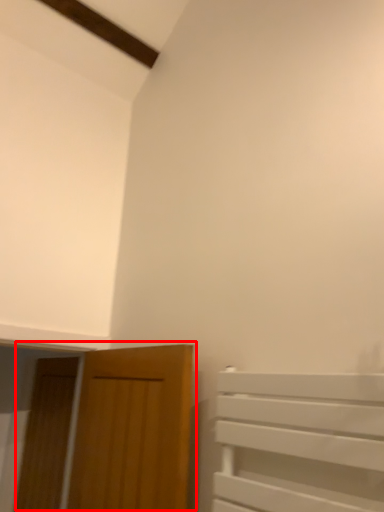
Question: Where is door (annotated by the red box) located in relation to door in the image?

Choices:
 (A) right
 (B) left

Answer: (A)